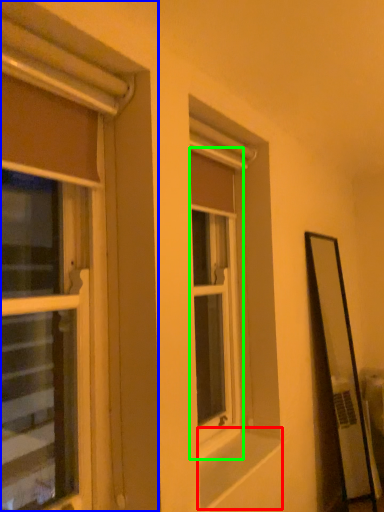
Question: Estimate the real-world distances between objects in this image. Which object is farther from window sill (highlighted by a red box), window (highlighted by a blue box) or window (highlighted by a green box)?

Choices:
 (A) window
 (B) window

Answer: (A)